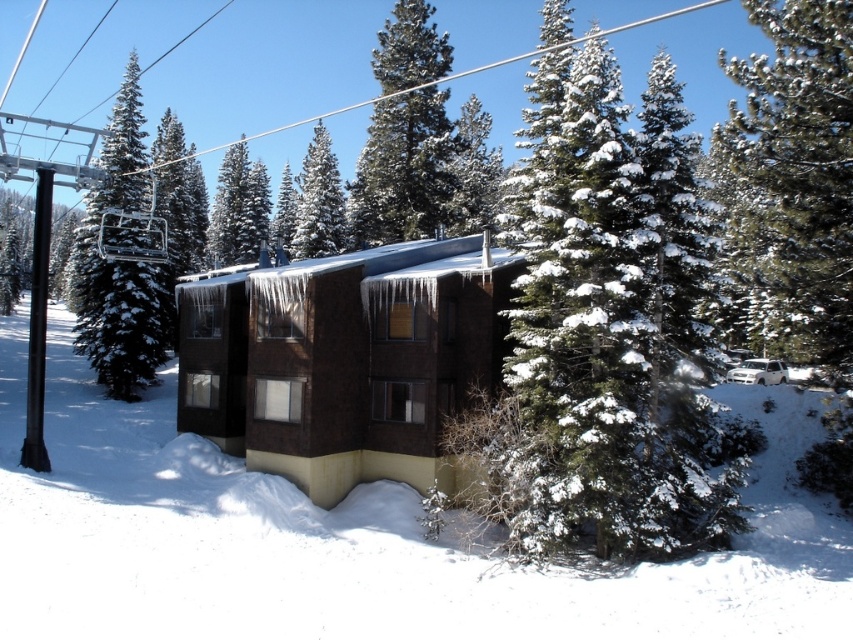
Question: Considering the relative positions of snow-covered pine at center and snow-covered pine tree at left in the image provided, where is snow-covered pine at center located with respect to snow-covered pine tree at left?

Choices:
 (A) below
 (B) above

Answer: (B)

Question: Does snow-covered pine at right appear over snow-covered pine at center?

Choices:
 (A) yes
 (B) no

Answer: (B)

Question: Which object is the farthest from the green matte tree at center?

Choices:
 (A) snow-covered pine at center
 (B) snow-covered pine at right
 (C) brown matte building at center
 (D) snow-covered pine tree at left

Answer: (B)

Question: Is brown matte building at center bigger than snow-covered pine tree at left?

Choices:
 (A) no
 (B) yes

Answer: (A)

Question: Which of the following is the closest to the observer?

Choices:
 (A) snow-covered pine tree at center
 (B) snow-covered pine at right

Answer: (B)

Question: Which point is closer to the camera taking this photo?

Choices:
 (A) (306, 321)
 (B) (753, 262)
 (C) (318, 176)

Answer: (A)